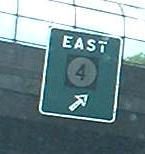
Identify the location of wall. (35, 70).